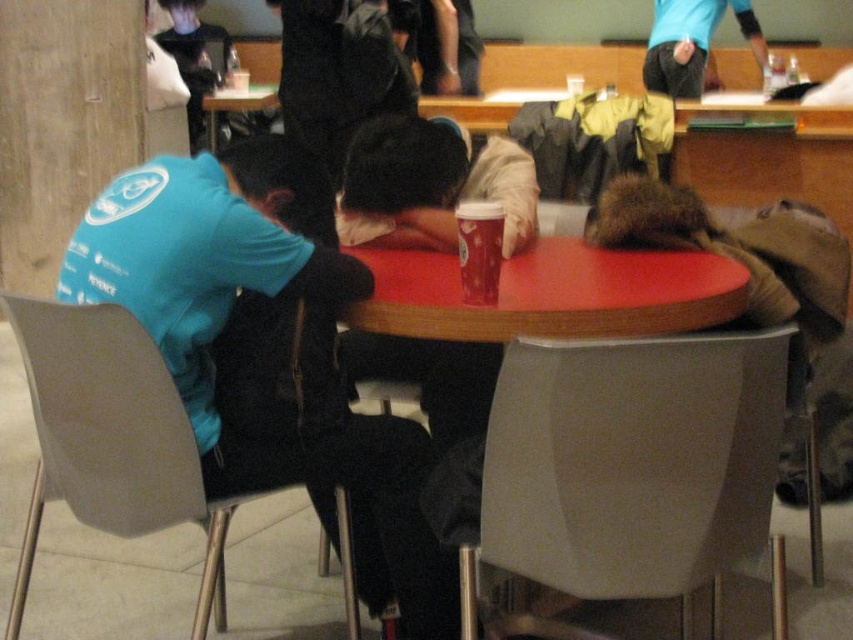
Does blue fleece jacket at left have a lesser width compared to smooth red table at center?

Indeed, blue fleece jacket at left has a lesser width compared to smooth red table at center.

Find the location of a particular element. blue fleece jacket at left is located at coordinates (223, 330).

You are a GUI agent. You are given a task and a screenshot of the screen. Output one action in this format:
    pyautogui.click(x=<x>, y=<y>)
    Task: Click on the blue fleece jacket at left
    
    Given the screenshot: What is the action you would take?
    pyautogui.click(x=223, y=330)

Can you confirm if matte gray chair at lower center is bigger than blue fleece jacket at left?

Incorrect, matte gray chair at lower center is not larger than blue fleece jacket at left.

Does matte gray chair at lower center appear over blue fleece jacket at left?

Incorrect, matte gray chair at lower center is not positioned above blue fleece jacket at left.

Does point (618, 385) lie behind point (308, 291)?

No, it is not.

This screenshot has width=853, height=640. I want to click on matte gray chair at lower center, so click(x=630, y=465).

How much distance is there between matte plastic chair at lower left and matte plastic cup at center?

A distance of 26.61 inches exists between matte plastic chair at lower left and matte plastic cup at center.

Between point (27, 561) and point (471, 218), which one is positioned behind?

The point (27, 561) is behind.

Who is more distant from viewer, [49,312] or [492,205]?

Positioned behind is point [492,205].

Locate an element on the screen. This screenshot has width=853, height=640. matte plastic chair at lower left is located at coordinates (111, 440).